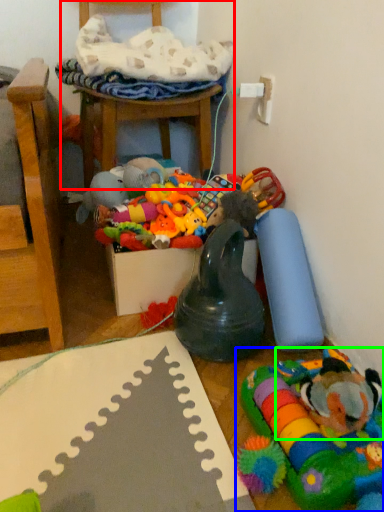
Question: Considering the real-world distances, which object is farthest from chair (highlighted by a red box)? toy (highlighted by a blue box) or toy (highlighted by a green box)?

Choices:
 (A) toy
 (B) toy

Answer: (B)